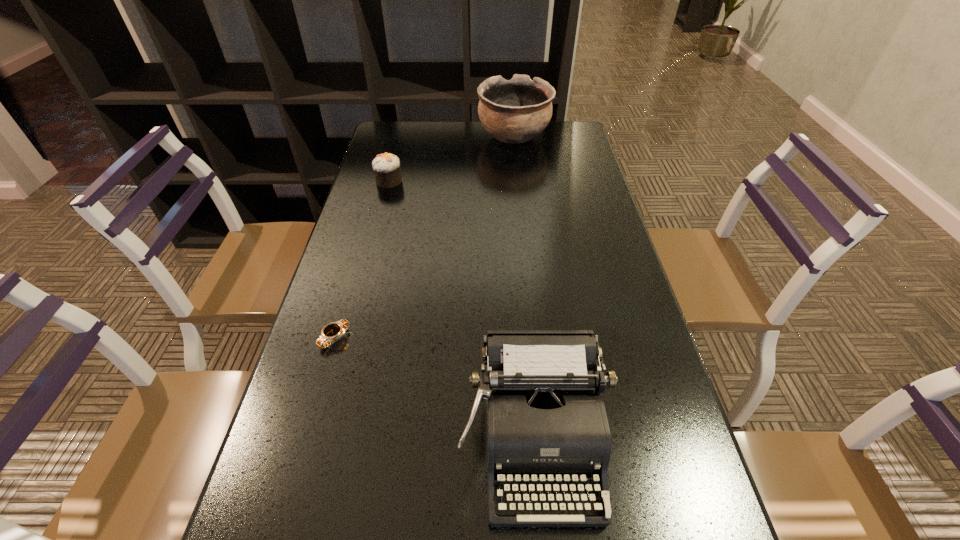
The image size is (960, 540). What are the coordinates of `object that is the third closest one to the tallest object` in the screenshot? It's located at (544, 421).

Locate an element on the screen. object identified as the third closest to the second shortest object is located at coordinates (544, 421).